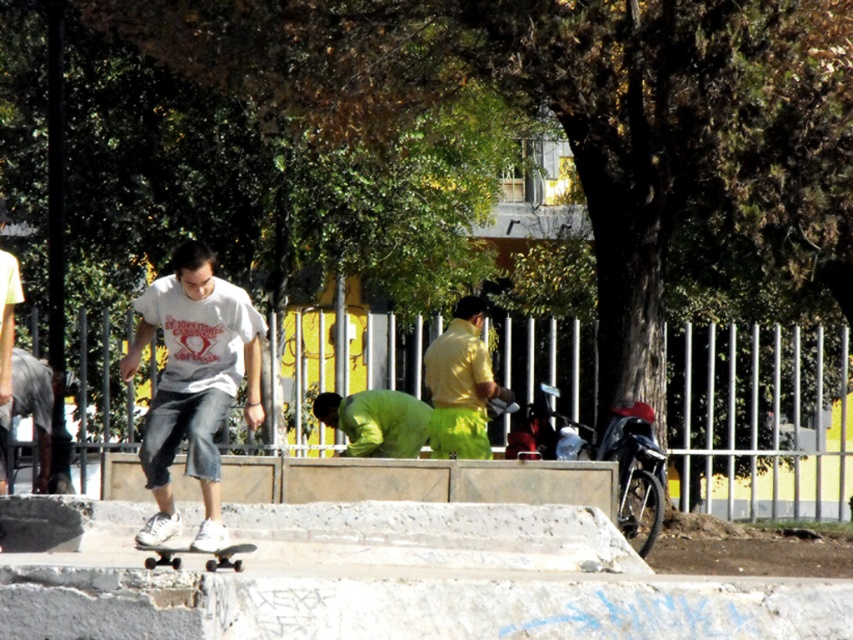
You are a photographer at the skatepark. You want to take a photo of the green matte shirt at center and the white matte skateboard at center. Which object should you focus on first if you want to capture both in the same frame without moving the camera?

The green matte shirt at center is to the right of the white matte skateboard at center, so you should focus on the white matte skateboard at center first as it is closer to the left side of the frame, ensuring both objects are within the camera view.